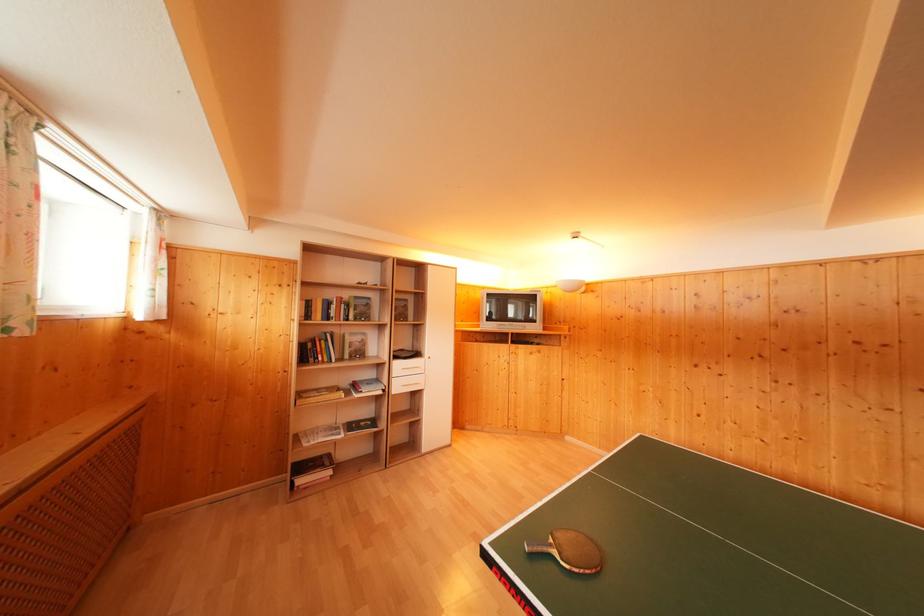
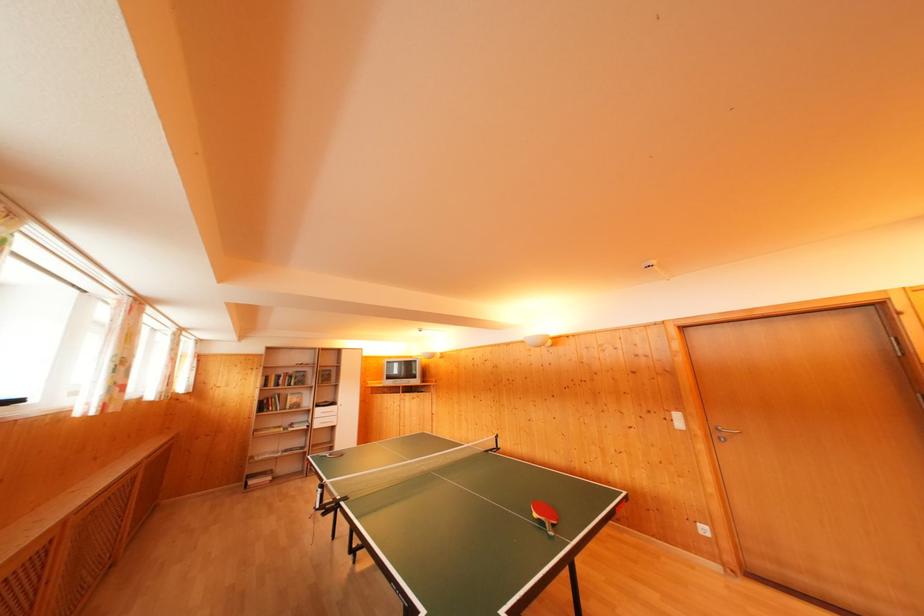
Find the pixel in the second image that matches the point at 402,370 in the first image.

(322, 416)